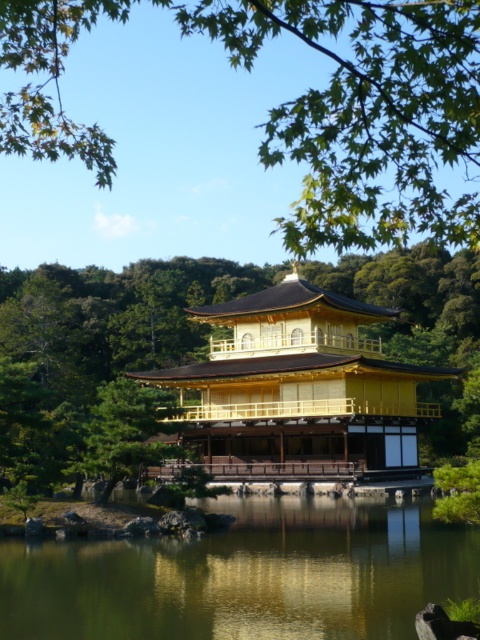
Question: Does green reflective water at center appear on the right side of gold lacquered wood palace at center?

Choices:
 (A) no
 (B) yes

Answer: (A)

Question: Which point is closer to the camera?

Choices:
 (A) (226, 444)
 (B) (360, 189)
 (C) (215, 588)

Answer: (C)

Question: Which of these objects is positioned closest to the green leafy tree at upper center?

Choices:
 (A) gold lacquered wood palace at center
 (B) green reflective water at center

Answer: (A)

Question: Does green leafy tree at upper center have a smaller size compared to green reflective water at center?

Choices:
 (A) yes
 (B) no

Answer: (B)

Question: Is green reflective water at center further to the viewer compared to gold lacquered wood palace at center?

Choices:
 (A) yes
 (B) no

Answer: (B)

Question: Among these objects, which one is farthest from the camera?

Choices:
 (A) green leafy tree at upper center
 (B) gold lacquered wood palace at center

Answer: (B)